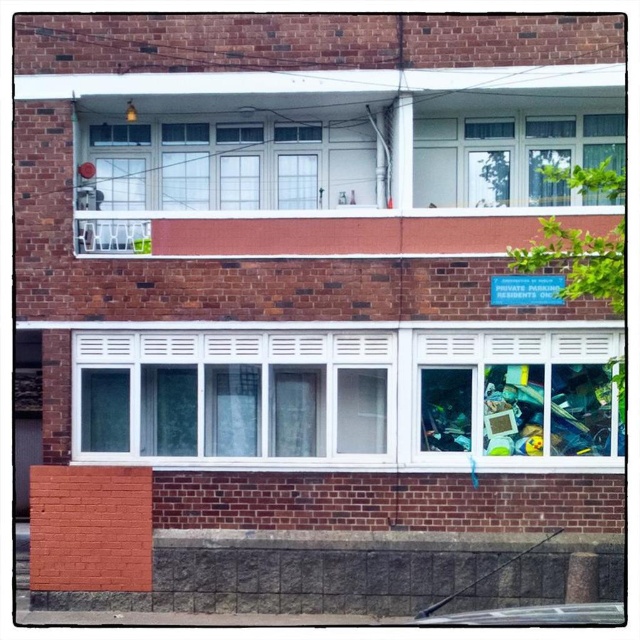
Does white plastic window at center have a greater width compared to transparent plastic window at center?

Yes, white plastic window at center is wider than transparent plastic window at center.

Which is behind, point (340, 401) or point (557, 362)?

The point (340, 401) is behind.

Locate an element on the screen. The width and height of the screenshot is (640, 640). white plastic window at center is located at coordinates (230, 394).